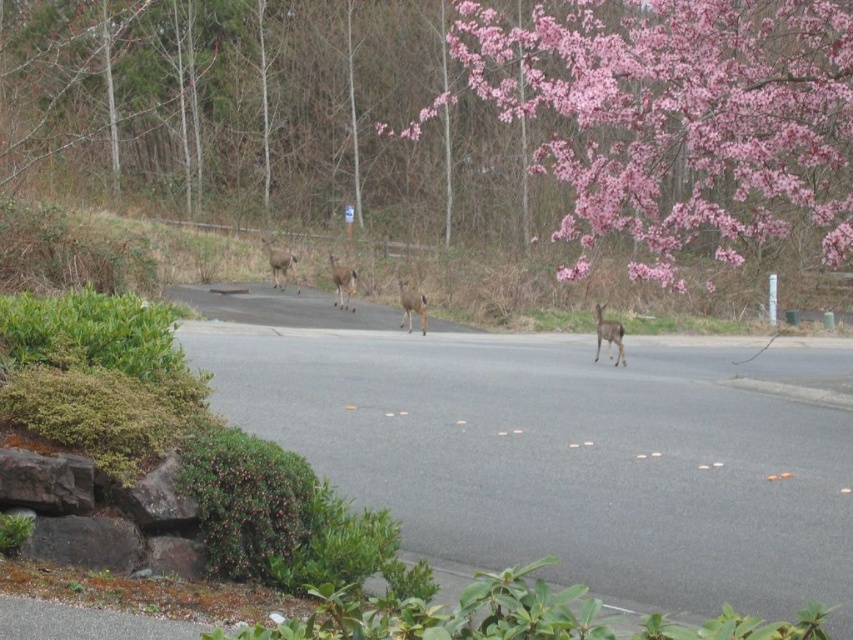
You are driving on the road and see two points marked on your GPS. The first point is at point (334, 259) and the second point is at point (598, 307). Which point is closer to your current position if you are driving towards the deer in the foreground?

Point (598, 307) is closer to your current position because it is in front of point (334, 259), which is behind it.

You are a photographer trying to capture the pink blossom tree at upper right and the brown matte deer at center in the same frame. Based on their positions, which object would appear higher in your photo?

The pink blossom tree at upper right appears higher in the photo because it is positioned above the brown matte deer at center.